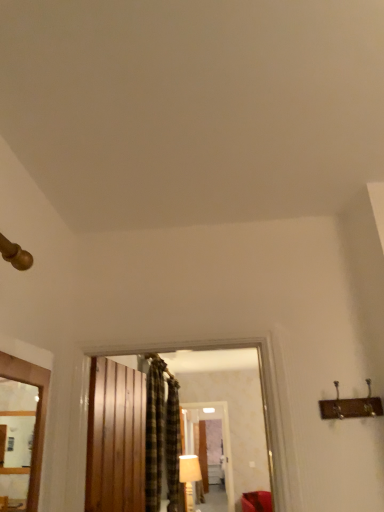
Question: Is plaid fabric curtain at center, arranged as the 1th curtain when viewed from the back, positioned behind wooden frame at left?

Choices:
 (A) no
 (B) yes

Answer: (B)

Question: Is plaid fabric curtain at center, arranged as the 1th curtain when viewed from the back, directly adjacent to wooden frame at left?

Choices:
 (A) no
 (B) yes

Answer: (A)

Question: Would you say plaid fabric curtain at center, which is the 2th curtain in front-to-back order, contains wooden frame at left?

Choices:
 (A) no
 (B) yes

Answer: (A)

Question: Considering the relative sizes of plaid fabric curtain at center, which is the 2th curtain in front-to-back order, and wooden frame at left in the image provided, is plaid fabric curtain at center, which is the 2th curtain in front-to-back order, smaller than wooden frame at left?

Choices:
 (A) no
 (B) yes

Answer: (A)

Question: From the image's perspective, is plaid fabric curtain at center, which is the 2th curtain in front-to-back order, below wooden frame at left?

Choices:
 (A) no
 (B) yes

Answer: (B)

Question: Is plaid fabric curtain at center, arranged as the 1th curtain when viewed from the back, wider than wooden frame at left?

Choices:
 (A) yes
 (B) no

Answer: (A)

Question: Is the depth of plaid fabric curtain at center, which is the 2th curtain in front-to-back order, less than that of white fabric lampshade at center?

Choices:
 (A) yes
 (B) no

Answer: (A)

Question: Is plaid fabric curtain at center, which is the 2th curtain in front-to-back order, bigger than white fabric lampshade at center?

Choices:
 (A) yes
 (B) no

Answer: (A)

Question: Can you see plaid fabric curtain at center, which is the 2th curtain in front-to-back order, touching white fabric lampshade at center?

Choices:
 (A) no
 (B) yes

Answer: (A)

Question: Is plaid fabric curtain at center, which is the 2th curtain in front-to-back order, behind white fabric lampshade at center?

Choices:
 (A) yes
 (B) no

Answer: (B)

Question: Considering the relative sizes of plaid fabric curtain at center, arranged as the 1th curtain when viewed from the back, and white fabric lampshade at center in the image provided, is plaid fabric curtain at center, arranged as the 1th curtain when viewed from the back, wider than white fabric lampshade at center?

Choices:
 (A) yes
 (B) no

Answer: (B)

Question: Is plaid fabric curtain at center, which is the 2th curtain in front-to-back order, taller than white fabric lampshade at center?

Choices:
 (A) yes
 (B) no

Answer: (A)

Question: Is wooden frame at left not inside white fabric lampshade at center?

Choices:
 (A) yes
 (B) no

Answer: (A)